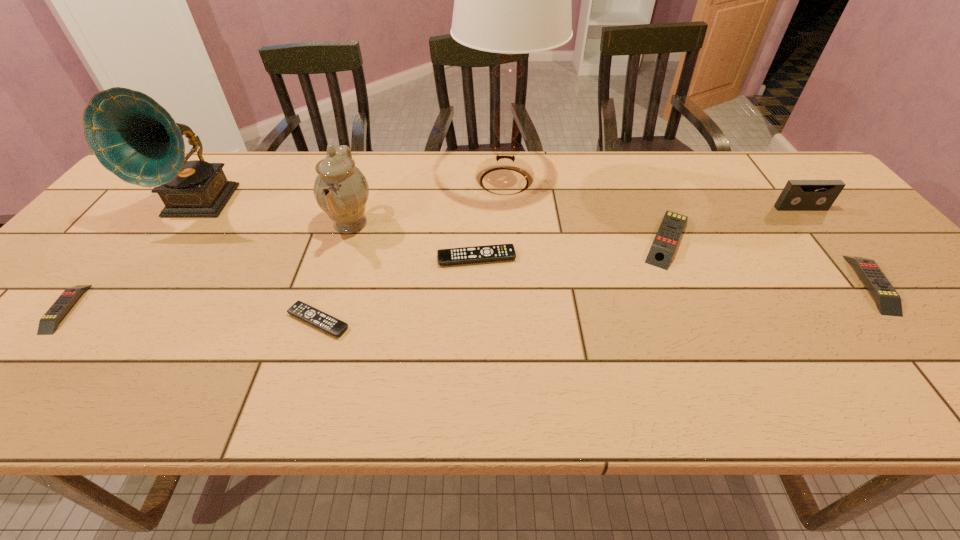
At what (x,y) coordinates should I click in order to perform the action: click on remote control that is positioned at the right edge. Please return your answer as a coordinate pair (x, y). This screenshot has height=540, width=960. Looking at the image, I should click on (888, 301).

I want to click on object that is positioned at the far left corner, so click(x=135, y=138).

Locate an element on the screen. The height and width of the screenshot is (540, 960). free region at the far edge of the desktop is located at coordinates (548, 163).

Find the location of a particular element. vacant space at the near edge is located at coordinates (516, 396).

In the image, there is a desktop. Where is `vacant space at the left edge`? This screenshot has width=960, height=540. vacant space at the left edge is located at coordinates (150, 218).

Locate an element on the screen. This screenshot has width=960, height=540. blank area at the far right corner is located at coordinates (754, 166).

Locate an element on the screen. vacant point located between the shortest object and the leftmost yellow remote control is located at coordinates (192, 315).

Image resolution: width=960 pixels, height=540 pixels. I want to click on vacant area that lies between the third remote control from left to right and the videotape, so click(x=638, y=233).

Where is `vacant region between the chinaware and the phonograph_record`? vacant region between the chinaware and the phonograph_record is located at coordinates 275,214.

Where is `empty space between the second smallest yellow remote control and the tallest object`? The image size is (960, 540). empty space between the second smallest yellow remote control and the tallest object is located at coordinates (687, 233).